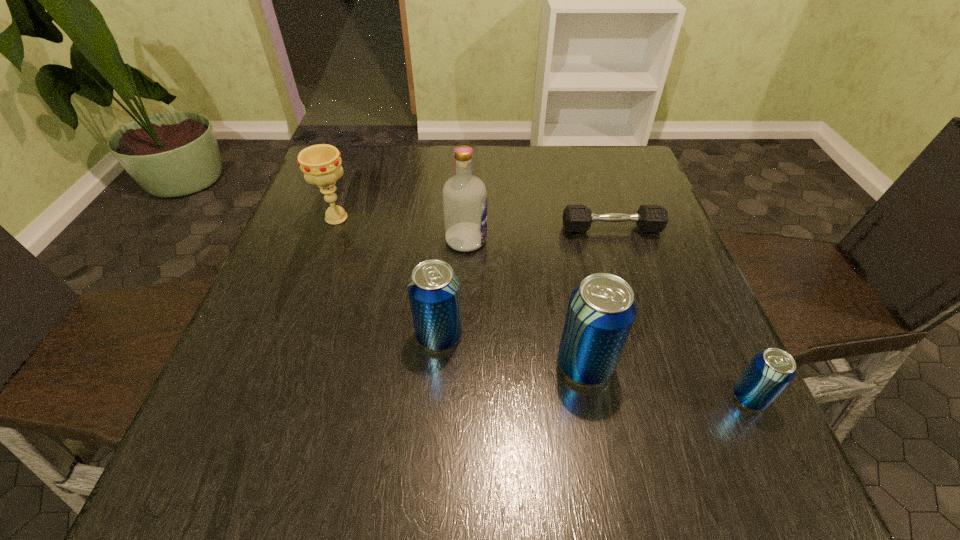
Please point a free position for a beer can on the left. Please provide its 2D coordinates. Your answer should be formatted as a tuple, i.e. [(x, y)], where the tuple contains the x and y coordinates of a point satisfying the conditions above.

[(308, 309)]